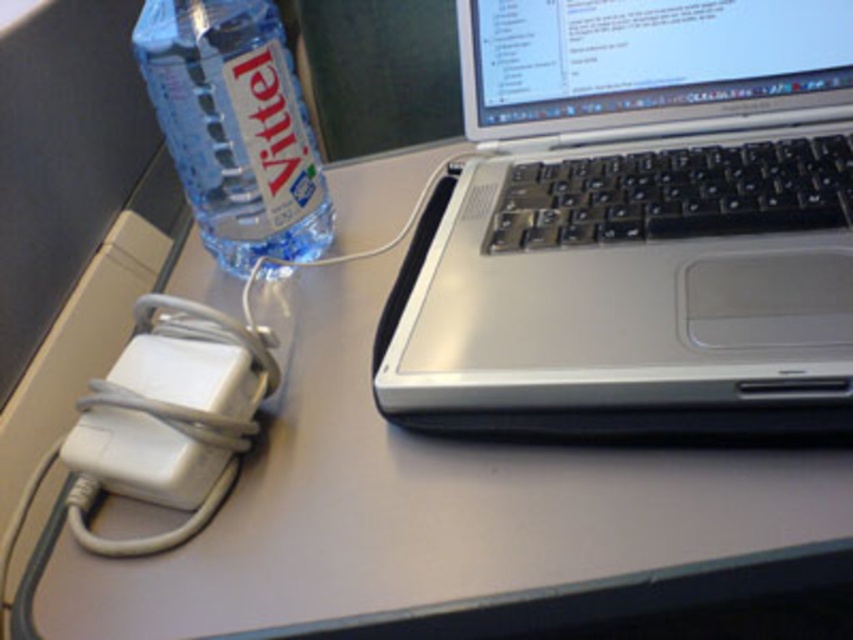
Question: Which object is the farthest from the silver metallic laptop at upper right?

Choices:
 (A) blue plastic bottle at left
 (B) white plastic charger at lower left

Answer: (A)

Question: Is silver metallic laptop at upper right thinner than blue plastic bottle at left?

Choices:
 (A) no
 (B) yes

Answer: (A)

Question: Does silver metallic laptop at upper right come behind white plastic charger at lower left?

Choices:
 (A) no
 (B) yes

Answer: (A)

Question: Can you confirm if silver metallic laptop at upper right is positioned to the right of blue plastic bottle at left?

Choices:
 (A) yes
 (B) no

Answer: (A)

Question: Based on their relative distances, which object is farther from the blue plastic bottle at left?

Choices:
 (A) white plastic charger at lower left
 (B) silver metallic laptop at upper right

Answer: (B)

Question: Which of the following is the farthest from the observer?

Choices:
 (A) (221, 195)
 (B) (590, 348)

Answer: (A)